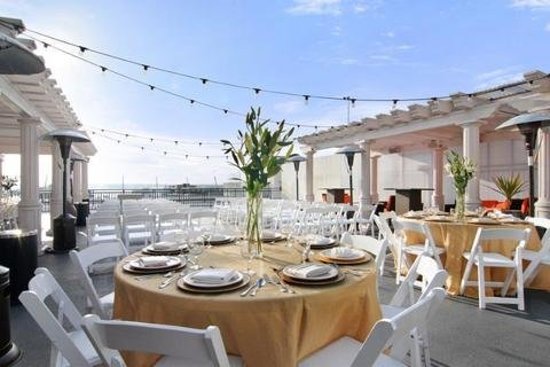
Locate an element on the screen. pillars is located at coordinates (22, 207), (56, 203), (79, 193), (86, 184), (308, 186), (362, 189), (434, 169), (468, 152), (541, 204), (376, 171).